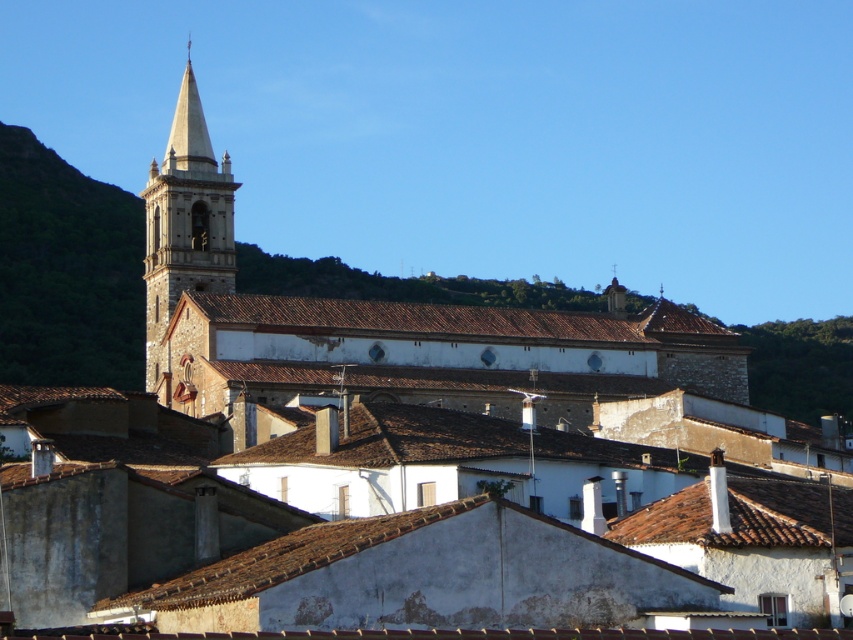
You are an architect analyzing the town layout. You notice the brown stone church at center and the stone steeple at upper left. Which structure has a lower height?

The brown stone church at center has a lesser height compared to the stone steeple at upper left, so the brown stone church at center is shorter in height.

You are standing in the historic town and want to take a photo of the brown stone church at center and the stone steeple at upper left. Which one should you focus on first if you want to capture both in sharp detail without moving the camera?

You should focus on the brown stone church at center first because it is closer to the viewer than the stone steeple at upper left, so adjusting the focus to the closer object will keep both in better focus.

You are standing in the historic town square and see the brown stone church at center and the stone steeple at upper left. Which structure is located higher up in the image?

The stone steeple at upper left is positioned higher up in the image than the brown stone church at center.